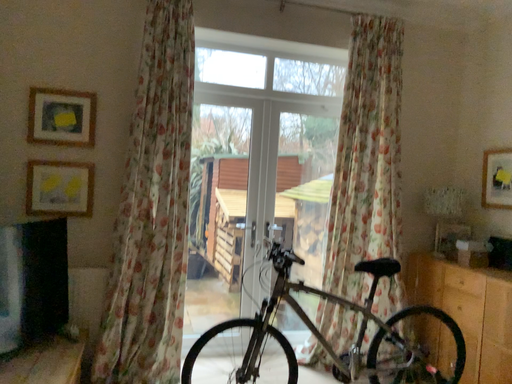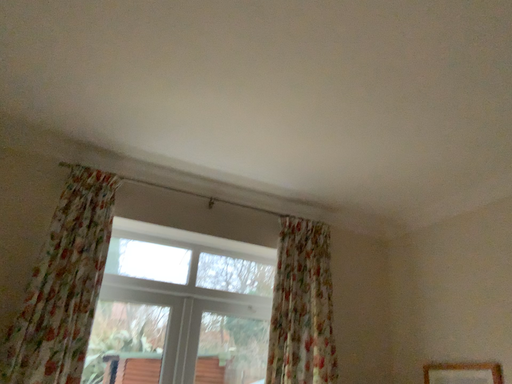
Question: How did the camera likely rotate when shooting the video?

Choices:
 (A) rotated right
 (B) rotated left

Answer: (A)